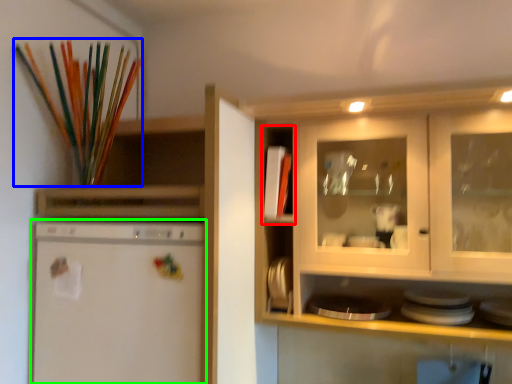
Question: Which object is positioned farthest from cabinet (highlighted by a red box)? Select from paint brush (highlighted by a blue box) and home appliance (highlighted by a green box).

Choices:
 (A) paint brush
 (B) home appliance

Answer: (A)